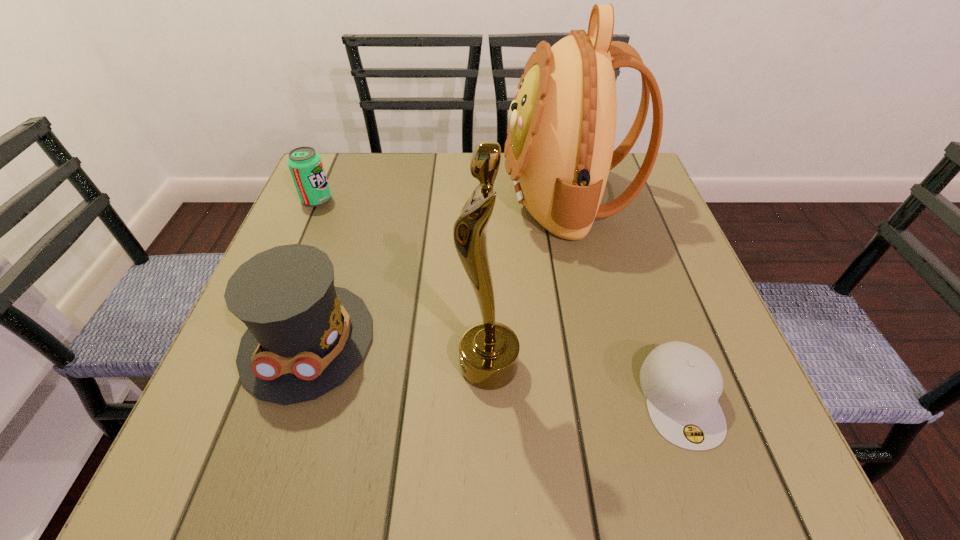
At what (x,y) coordinates should I click in order to perform the action: click on free point located on the front-facing side of the award. Please return your answer as a coordinate pair (x, y). This screenshot has height=540, width=960. Looking at the image, I should click on (321, 367).

The height and width of the screenshot is (540, 960). I want to click on vacant space positioned with goggles on the front of the dress hat, so click(269, 459).

Find the location of a particular element. vacant space located on the front-facing side of the fourth tallest object is located at coordinates (428, 199).

This screenshot has width=960, height=540. What are the coordinates of `backpack situated at the far edge` in the screenshot? It's located at (x=561, y=132).

The width and height of the screenshot is (960, 540). I want to click on pop soda that is at the far edge, so click(305, 165).

Identify the location of object that is at the near edge. The width and height of the screenshot is (960, 540). [x=682, y=384].

Identify the location of dress hat that is at the left edge. (305, 337).

Find the location of a particular element. This screenshot has height=540, width=960. pop soda that is at the left edge is located at coordinates (305, 165).

Identify the location of backpack situated at the right edge. (561, 132).

Image resolution: width=960 pixels, height=540 pixels. I want to click on cap that is at the right edge, so click(682, 384).